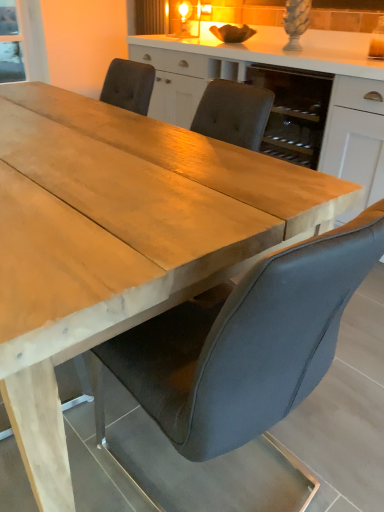
Question: Is white matte cabinet at center taller or shorter than suede gray chair at center?

Choices:
 (A) tall
 (B) short

Answer: (A)

Question: From the image's perspective, is white matte cabinet at center located above or below suede gray chair at center?

Choices:
 (A) above
 (B) below

Answer: (A)

Question: Considering the positions of white matte cabinet at center and suede gray chair at center in the image, is white matte cabinet at center bigger or smaller than suede gray chair at center?

Choices:
 (A) big
 (B) small

Answer: (A)

Question: Is suede gray chair at center to the left or to the right of white matte cabinet at center in the image?

Choices:
 (A) right
 (B) left

Answer: (B)

Question: From a real-world perspective, is suede gray chair at center positioned above or below white matte cabinet at center?

Choices:
 (A) above
 (B) below

Answer: (B)

Question: Considering the positions of suede gray chair at center and white matte cabinet at center in the image, is suede gray chair at center taller or shorter than white matte cabinet at center?

Choices:
 (A) tall
 (B) short

Answer: (B)

Question: Considering the positions of suede gray chair at center and white matte cabinet at center in the image, is suede gray chair at center bigger or smaller than white matte cabinet at center?

Choices:
 (A) small
 (B) big

Answer: (A)